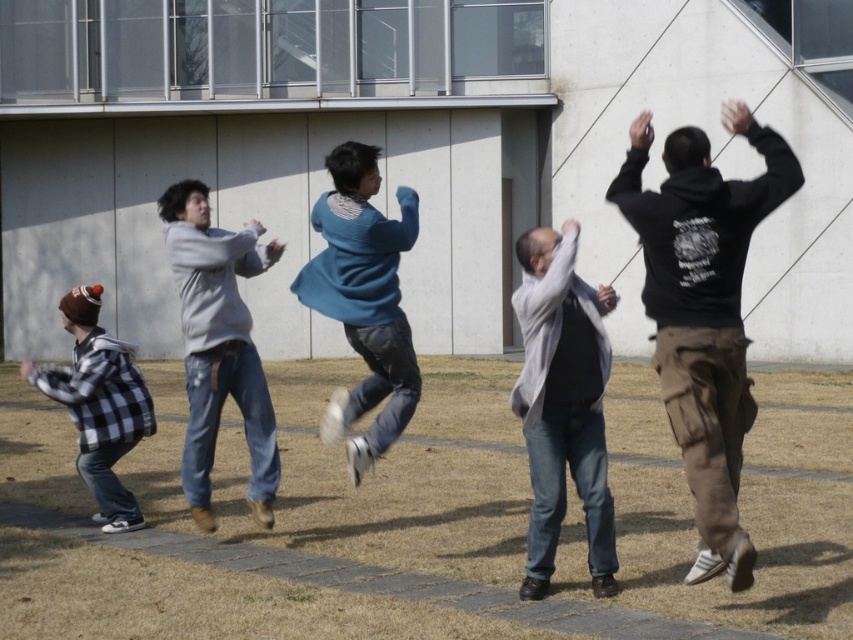
You are standing at point (254,221) and want to walk to point (355,323). Is the destination point in front of you or behind you?

The destination point (355,323) is in front of point (254,221), so it is in front of you.

You are standing at the origin point of the coordinate system in the image. The black matte hoodie at right is located at point (x=703, y=310). If you want to walk directly towards the black matte hoodie at right, which direction should you move in?

To walk directly towards the black matte hoodie at right located at point (x=703, y=310), you should move northeast since the coordinates indicate a position to the right and above your current position at the origin.

Looking at this image, you are standing at the origin point of the coordinate system in the image. The black matte hoodie at right is at position 0.486 on the x and 0.825 on the y axis. If you want to walk directly to the hoodie, which direction should you move first?

You should move to the right first because the x coordinate of the black matte hoodie at right is 0.486, which is to the right of the origin point.